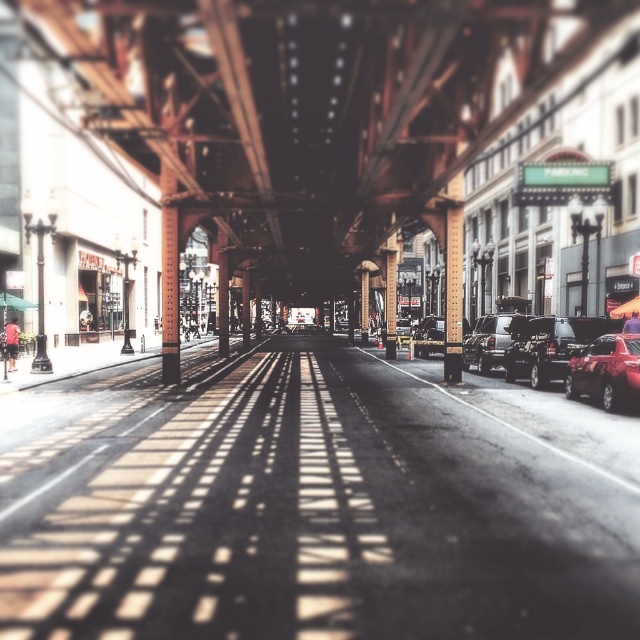
Question: Which object is the closest to the shiny black sedan at center?

Choices:
 (A) shiny red sedan at right
 (B) metallic silver decker bus at center
 (C) rusty metal overpass at center
 (D) shiny black sedan at center-right

Answer: (C)

Question: Can you confirm if shiny black sedan at right is positioned to the right of shiny black sedan at center-right?

Choices:
 (A) yes
 (B) no

Answer: (A)

Question: Is rusty metal overpass at center above brown wood pillar at center?

Choices:
 (A) yes
 (B) no

Answer: (A)

Question: Which point is closer to the camera taking this photo?

Choices:
 (A) (292, 316)
 (B) (365, 342)
 (C) (513, 330)

Answer: (C)

Question: Which object appears farthest from the camera in this image?

Choices:
 (A) rusty metal overpass at center
 (B) brown wood pillar at center
 (C) shiny red sedan at right
 (D) shiny black sedan at right

Answer: (B)

Question: Is shiny black sedan at center wider than brown wood pillar at center?

Choices:
 (A) yes
 (B) no

Answer: (A)